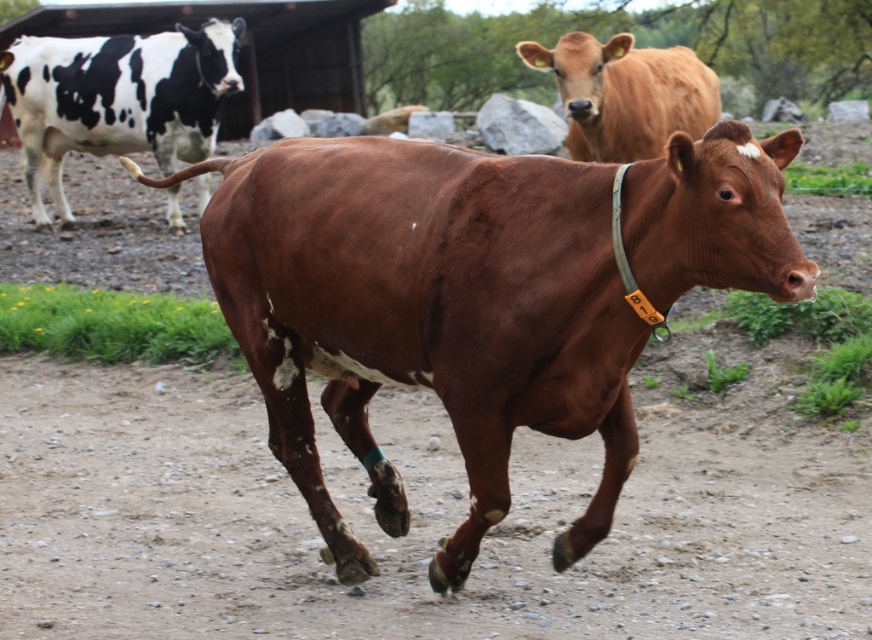
Is brown smooth cow at center further to camera compared to black and white spotted cow at upper left?

No, brown smooth cow at center is in front of black and white spotted cow at upper left.

Can you confirm if brown smooth cow at center is positioned below black and white spotted cow at upper left?

Indeed, brown smooth cow at center is positioned under black and white spotted cow at upper left.

Is point (714, 150) closer to viewer compared to point (106, 132)?

Yes, it is.

At what (x,y) coordinates should I click in order to perform the action: click on brown smooth cow at center. Please return your answer as a coordinate pair (x, y). Looking at the image, I should click on (475, 298).

Is point (436, 564) closer to viewer compared to point (612, 48)?

That is True.

Which of these two, brown smooth cow at center or brown smooth cow at upper center, stands shorter?

brown smooth cow at upper center is shorter.

Which is behind, point (477, 173) or point (641, 72)?

The point (641, 72) is behind.

Identify the location of brown smooth cow at center. (475, 298).

Can you confirm if black and white spotted cow at upper left is smaller than brown smooth cow at upper center?

No.

Is point (96, 81) behind point (595, 134)?

Yes, point (96, 81) is behind point (595, 134).

Image resolution: width=872 pixels, height=640 pixels. I want to click on black and white spotted cow at upper left, so click(117, 99).